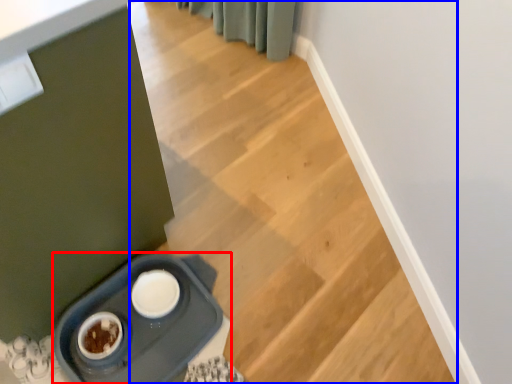
Question: Which object is further to the camera taking this photo, appliance (highlighted by a red box) or stairs (highlighted by a blue box)?

Choices:
 (A) appliance
 (B) stairs

Answer: (A)